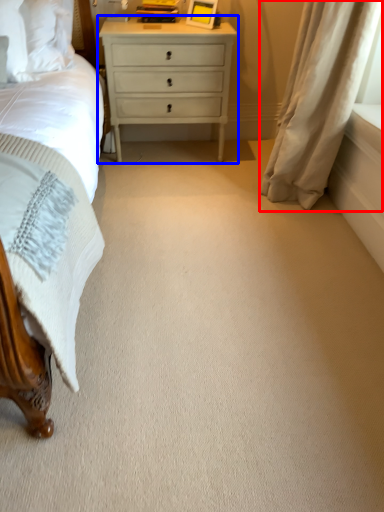
Question: Which point is closer to the camera, curtain (highlighted by a red box) or nightstand (highlighted by a blue box)?

Choices:
 (A) curtain
 (B) nightstand

Answer: (A)